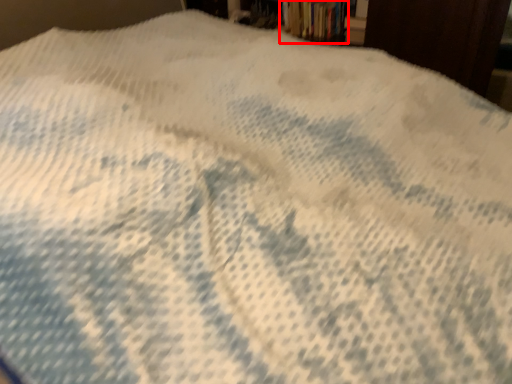
Question: In this image, where is book (annotated by the red box) located relative to paperback book?

Choices:
 (A) left
 (B) right

Answer: (A)